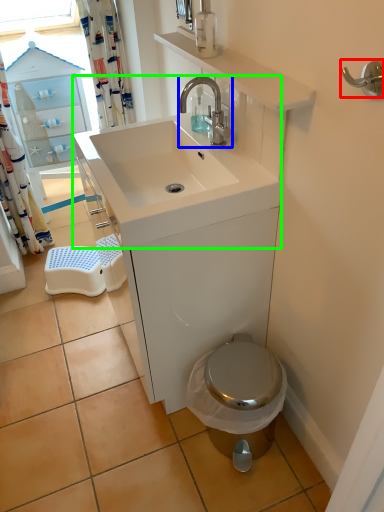
Question: Based on their relative distances, which object is nearer to door handle (highlighted by a red box)? Choose from tap (highlighted by a blue box) and sink (highlighted by a green box).

Choices:
 (A) tap
 (B) sink

Answer: (A)